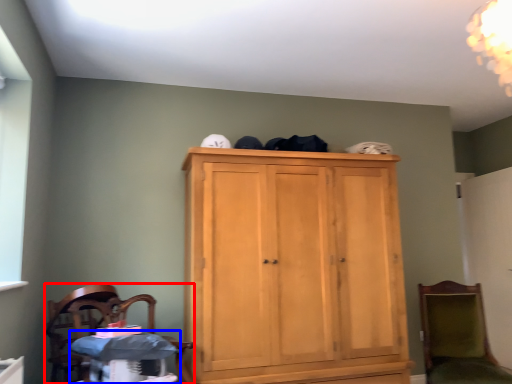
Question: Which object appears farthest to the camera in this image, chair (highlighted by a red box) or changing table (highlighted by a blue box)?

Choices:
 (A) chair
 (B) changing table

Answer: (B)